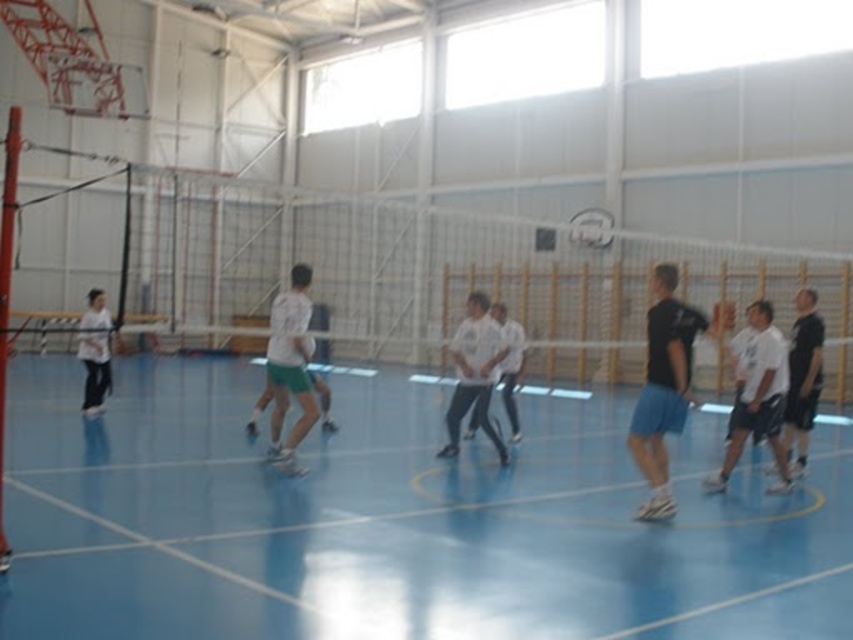
Question: Which point is closer to the camera?

Choices:
 (A) (473, 336)
 (B) (471, 492)
 (C) (242, 289)
 (D) (660, 332)

Answer: (D)

Question: Which point is closer to the camera taking this photo?

Choices:
 (A) (595, 211)
 (B) (714, 477)
 (C) (672, 506)
 (D) (346, 305)

Answer: (C)

Question: Does blue smooth basketball court at center appear on the left side of white matte shirt at center?

Choices:
 (A) no
 (B) yes

Answer: (B)

Question: Is white mesh net at center to the right of white matte shorts at right from the viewer's perspective?

Choices:
 (A) yes
 (B) no

Answer: (B)

Question: Is the position of white matte shorts at right more distant than that of white cotton shirt at center?

Choices:
 (A) no
 (B) yes

Answer: (A)

Question: Which of the following is the farthest from the observer?

Choices:
 (A) (764, 340)
 (B) (224, 216)
 (C) (756, 556)

Answer: (B)